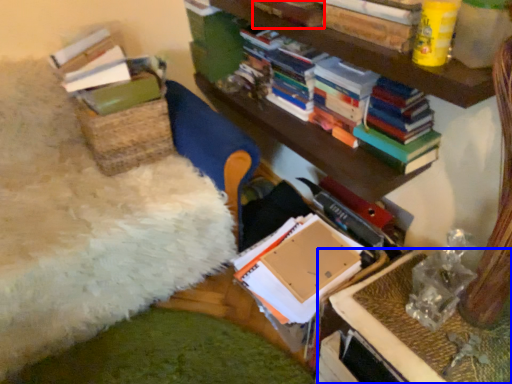
Question: Which point is further to the camera, book (highlighted by a red box) or table (highlighted by a blue box)?

Choices:
 (A) book
 (B) table

Answer: (A)